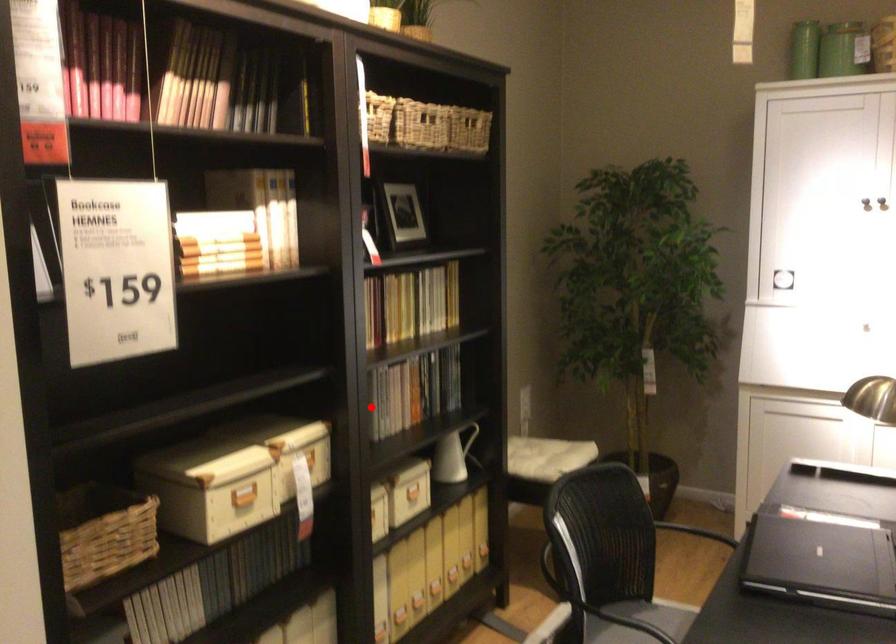
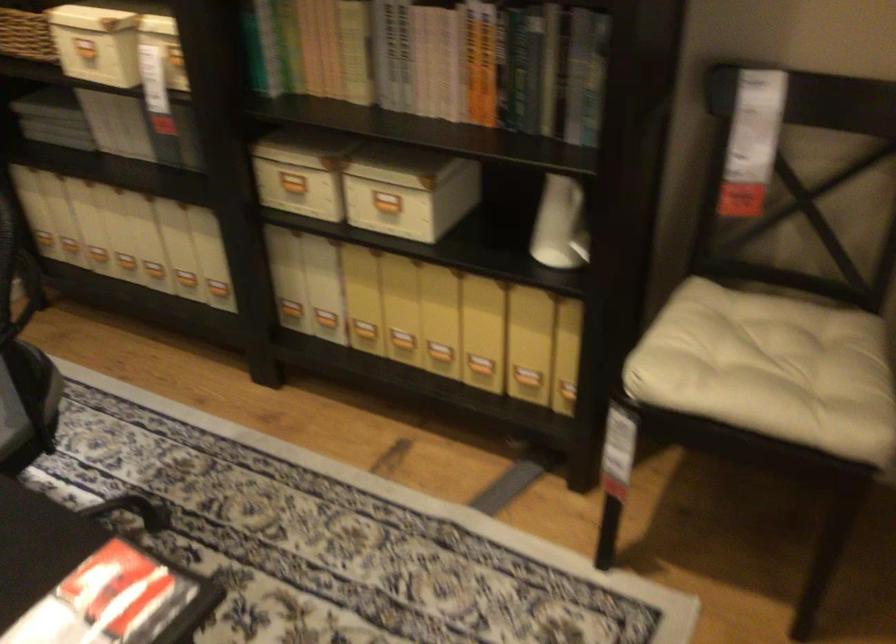
In the second image, find the point that corresponds to the highlighted location in the first image.

(438, 62)